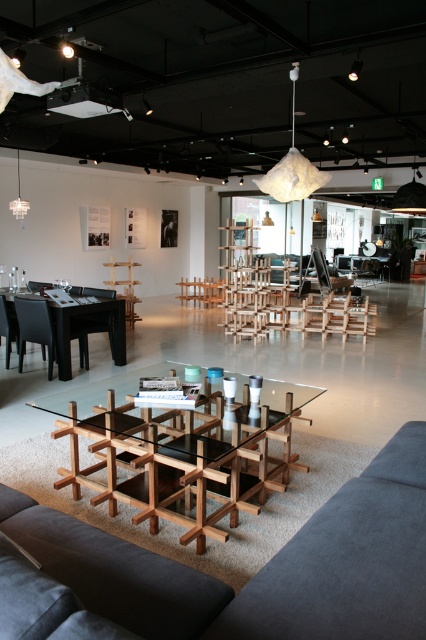
Does black glossy table at left have a smaller size compared to wooden chair at left?

Yes, black glossy table at left is smaller than wooden chair at left.

Which of these two, black glossy table at left or wooden chair at left, stands shorter?

With less height is black glossy table at left.

Is point (60, 362) behind point (74, 317)?

That is False.

Identify the location of black glossy table at left. This screenshot has width=426, height=640. (83, 314).

Does velvet dark grey couch at lower center appear under wooden chair at left?

Yes.

Is velvet dark grey couch at lower center smaller than wooden chair at left?

No, velvet dark grey couch at lower center is not smaller than wooden chair at left.

Which is in front, point (379, 592) or point (86, 321)?

Positioned in front is point (379, 592).

Where is `velvet dark grey couch at lower center`? This screenshot has width=426, height=640. velvet dark grey couch at lower center is located at coordinates (264, 564).

Locate an element on the screen. Image resolution: width=426 pixels, height=640 pixels. velvet dark grey couch at lower center is located at coordinates (264, 564).

Consider the image. Is velvet dark grey couch at lower center further to the viewer compared to black glossy table at left?

No, velvet dark grey couch at lower center is in front of black glossy table at left.

Does point (377, 499) lie in front of point (55, 310)?

That is True.

The image size is (426, 640). What are the coordinates of `velvet dark grey couch at lower center` in the screenshot? It's located at (264, 564).